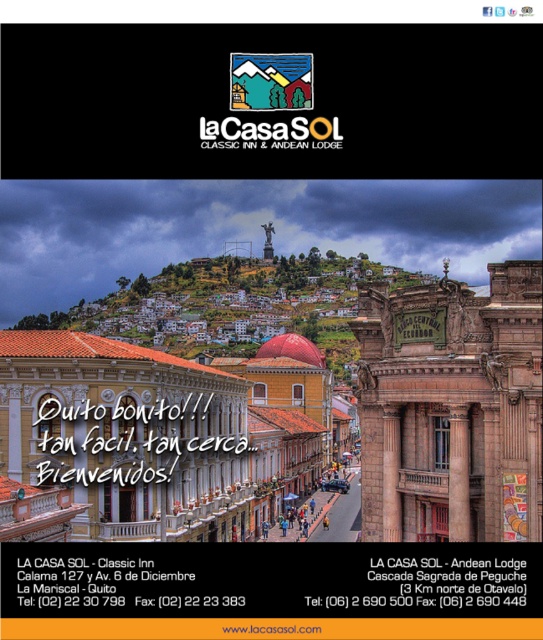
Question: Is multicolored wooden house at upper center to the left of brown stone column at center from the viewer's perspective?

Choices:
 (A) no
 (B) yes

Answer: (B)

Question: Is brown stone building at center wider than brown stone column at center?

Choices:
 (A) yes
 (B) no

Answer: (A)

Question: Which point is farther to the camera?

Choices:
 (A) (146, 536)
 (B) (454, 493)
 (C) (262, 99)

Answer: (C)

Question: Is brown stone building at center further to camera compared to brown stone column at center?

Choices:
 (A) yes
 (B) no

Answer: (B)

Question: Which object is farther from the camera taking this photo?

Choices:
 (A) brown stone column at center
 (B) brown stone building at center
 (C) multicolored wooden house at upper center

Answer: (C)

Question: Which point is farther from the camera taking this photo?

Choices:
 (A) (457, 406)
 (B) (21, 474)
 (C) (289, 83)

Answer: (C)